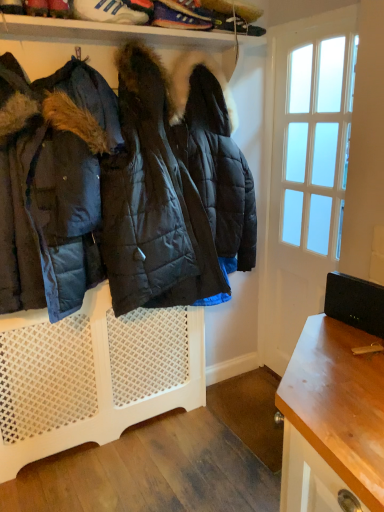
The width and height of the screenshot is (384, 512). I want to click on free point below matte black jacket at left (from a real-world perspective), so click(x=166, y=444).